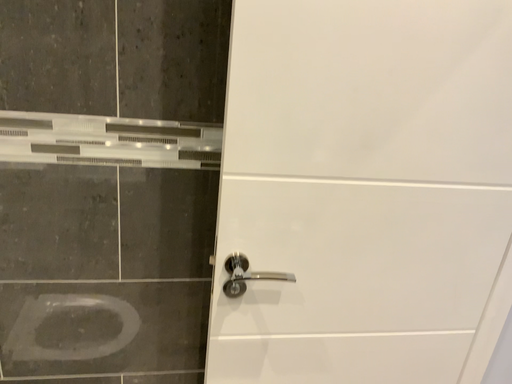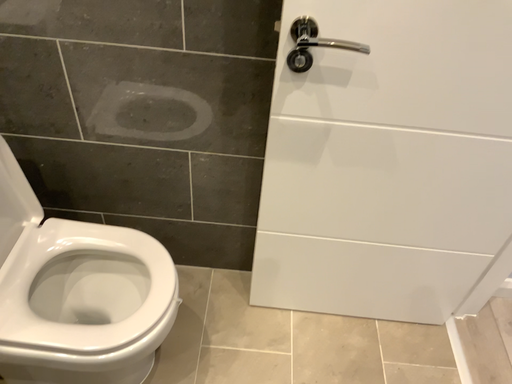
Question: How did the camera likely rotate when shooting the video?

Choices:
 (A) rotated upward
 (B) rotated downward

Answer: (B)